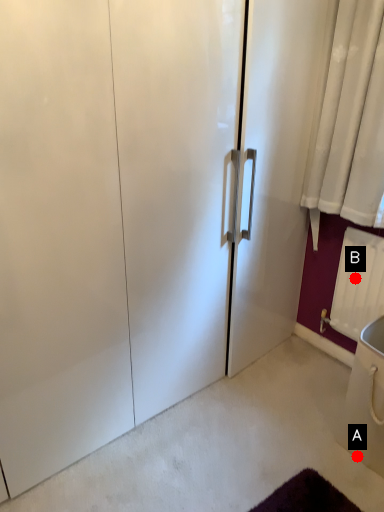
Question: Two points are circled on the image, labeled by A and B beside each circle. Which point is farther from the camera taking this photo?

Choices:
 (A) A is further
 (B) B is further

Answer: (B)